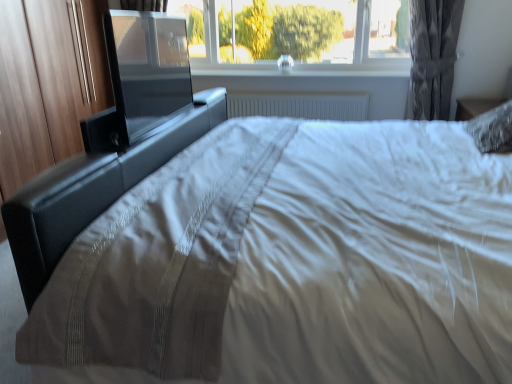
Question: Is black leather bed frame at center surrounding white plastic radiator at center?

Choices:
 (A) yes
 (B) no

Answer: (B)

Question: Is black leather bed frame at center far away from white plastic radiator at center?

Choices:
 (A) yes
 (B) no

Answer: (A)

Question: Can you confirm if black leather bed frame at center is wider than white plastic radiator at center?

Choices:
 (A) no
 (B) yes

Answer: (B)

Question: From the image's perspective, is black leather bed frame at center located beneath white plastic radiator at center?

Choices:
 (A) no
 (B) yes

Answer: (B)

Question: From a real-world perspective, is black leather bed frame at center positioned over white plastic radiator at center based on gravity?

Choices:
 (A) yes
 (B) no

Answer: (A)

Question: Is black leather bed frame at center to the left of white plastic radiator at center from the viewer's perspective?

Choices:
 (A) no
 (B) yes

Answer: (B)

Question: Is gray textured curtain at upper right positioned with its back to white plastic radiator at center?

Choices:
 (A) no
 (B) yes

Answer: (A)

Question: From the image's perspective, does gray textured curtain at upper right appear lower than white plastic radiator at center?

Choices:
 (A) no
 (B) yes

Answer: (A)

Question: Is gray textured curtain at upper right completely or partially outside of white plastic radiator at center?

Choices:
 (A) yes
 (B) no

Answer: (A)

Question: From a real-world perspective, does gray textured curtain at upper right stand above white plastic radiator at center?

Choices:
 (A) no
 (B) yes

Answer: (B)

Question: Is gray textured curtain at upper right far from white plastic radiator at center?

Choices:
 (A) no
 (B) yes

Answer: (A)

Question: Considering the relative sizes of gray textured curtain at upper right and white plastic radiator at center in the image provided, is gray textured curtain at upper right bigger than white plastic radiator at center?

Choices:
 (A) no
 (B) yes

Answer: (B)

Question: Considering the relative sizes of gray textured curtain at upper right and black leather bed frame at center in the image provided, is gray textured curtain at upper right thinner than black leather bed frame at center?

Choices:
 (A) no
 (B) yes

Answer: (B)